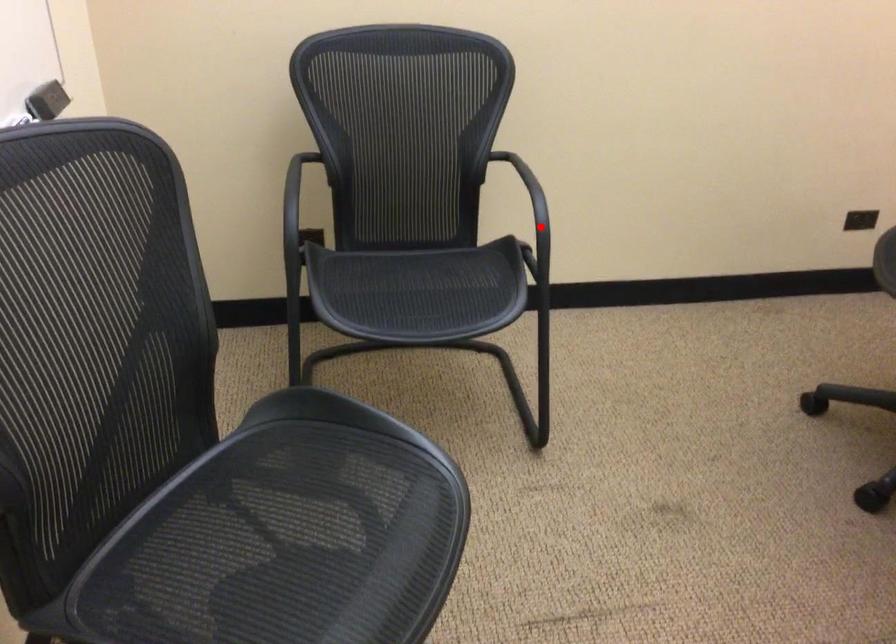
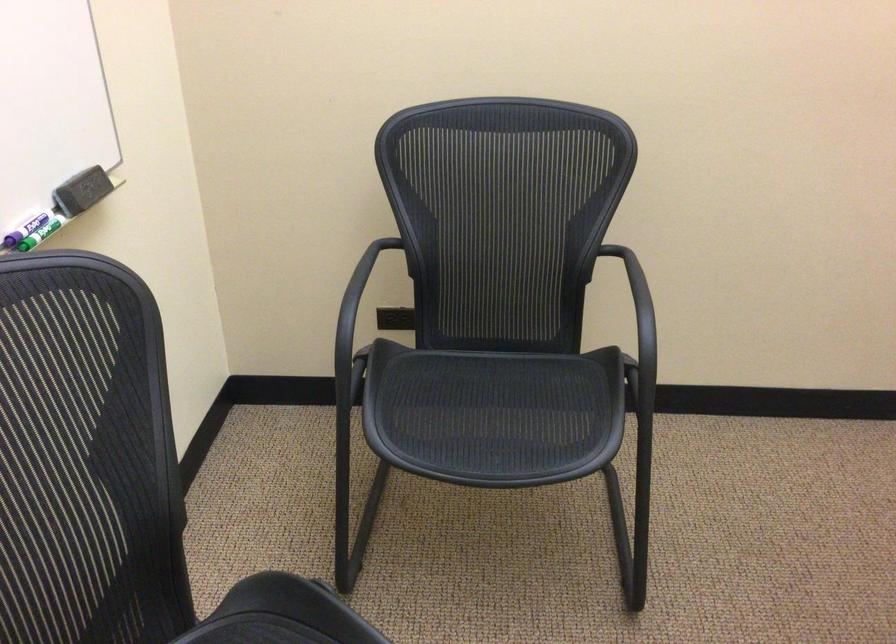
Question: I am providing you with two images of the same scene from different viewpoints. In image1, a red point is highlighted. Considering the same 3D point in image2, which of the following is correct?

Choices:
 (A) It is closer
 (B) It is farther

Answer: (A)